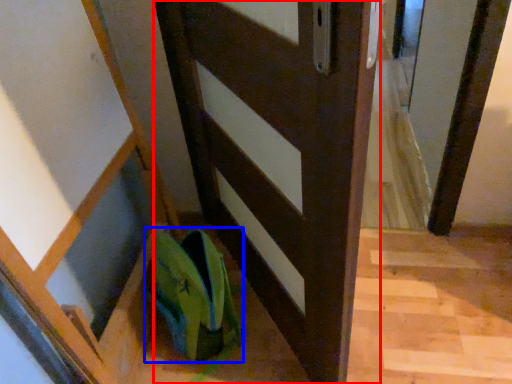
Question: Which object appears farthest to the camera in this image, door (highlighted by a red box) or shoe (highlighted by a blue box)?

Choices:
 (A) door
 (B) shoe

Answer: (B)